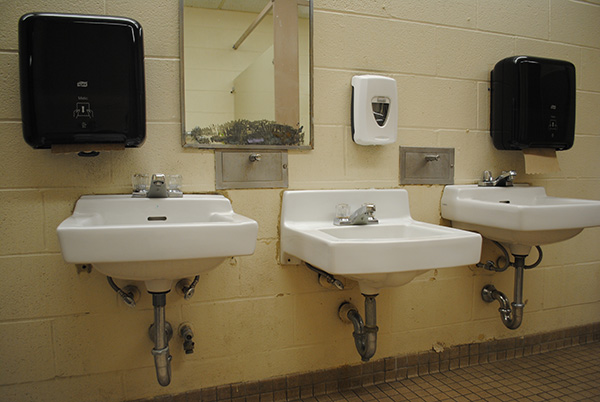
Identify the location of light brown frame around mirror. (180, 67), (312, 71).